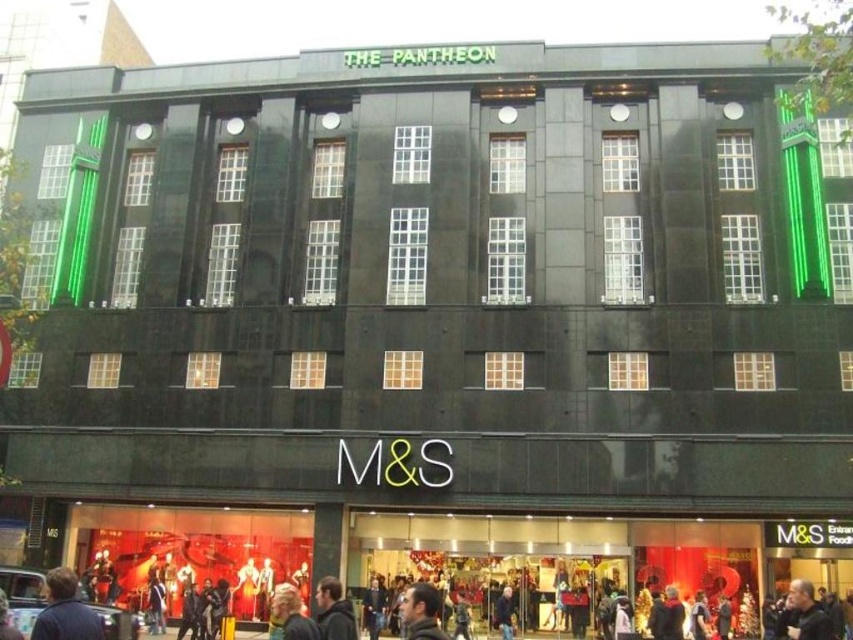
Question: Is dark blue jacket at lower left positioned in front of dark brown jacket at center?

Choices:
 (A) no
 (B) yes

Answer: (B)

Question: Estimate the real-world distances between objects in this image. Which object is farther from the dark blue jacket at lower left?

Choices:
 (A) dark brown hair at lower center
 (B) dark brown jacket at center
 (C) dark brown leather jacket at lower right

Answer: (C)

Question: Observing the image, what is the correct spatial positioning of dark brown leather jacket at lower right in reference to dark brown hair at lower center?

Choices:
 (A) right
 (B) left

Answer: (A)

Question: Which point appears farthest from the camera in this image?

Choices:
 (A) (54, 593)
 (B) (320, 627)

Answer: (B)

Question: Where is dark blue jacket at lower left located in relation to dark brown hair at lower center in the image?

Choices:
 (A) above
 (B) below

Answer: (A)

Question: Which point is closer to the camera?

Choices:
 (A) dark brown leather jacket at lower right
 (B) dark brown jacket at center

Answer: (B)